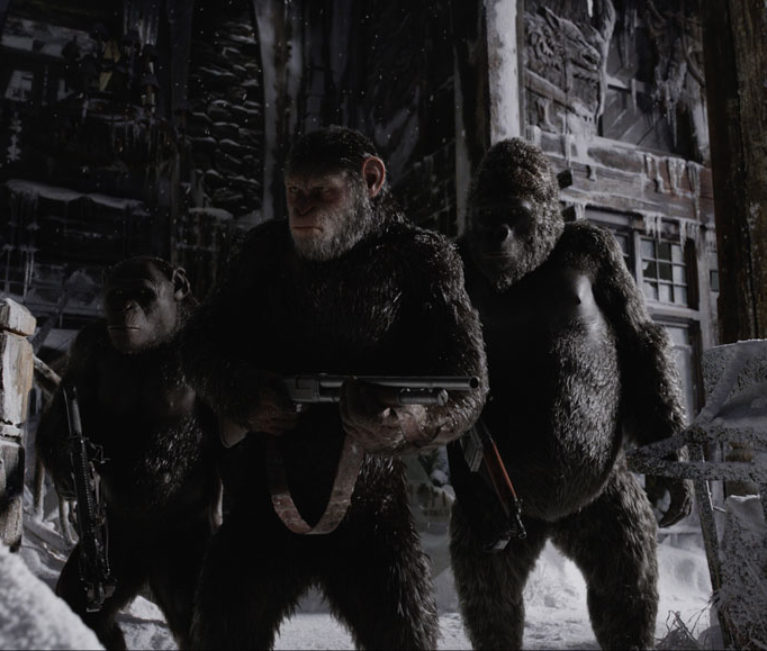
Where is `wall`? wall is located at coordinates (234, 130), (636, 124).